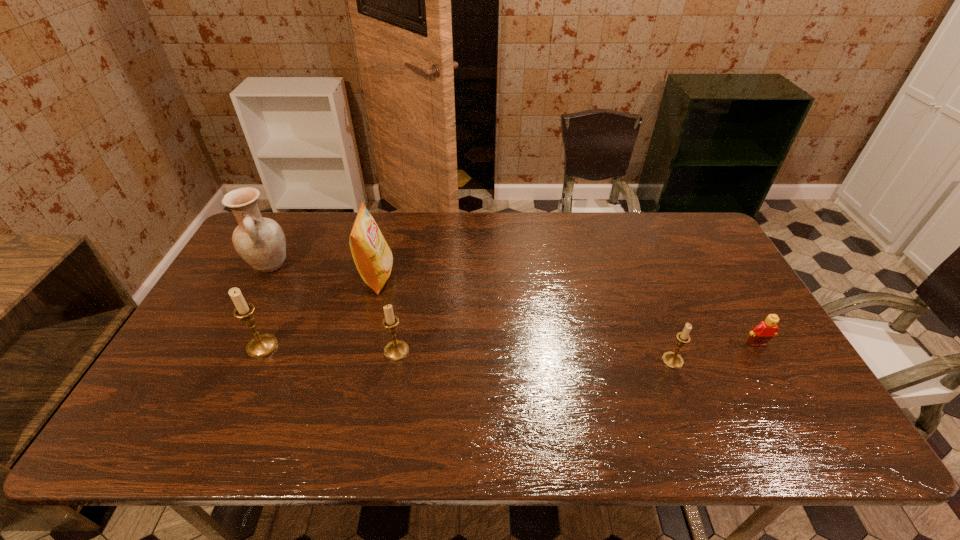
Identify the location of the tallest candle holder. coord(260,346).

The image size is (960, 540). In order to click on the second candle holder from left to right in this screenshot , I will do `click(396, 350)`.

Find the location of a particular element. The image size is (960, 540). the third object from right to left is located at coordinates (396, 350).

Locate an element on the screen. This screenshot has width=960, height=540. the shortest candle holder is located at coordinates (671, 359).

I want to click on the second shortest object, so click(671, 359).

Where is `crisp (potato chip)`? The image size is (960, 540). crisp (potato chip) is located at coordinates pos(373,258).

Where is `pottery`? The width and height of the screenshot is (960, 540). pottery is located at coordinates (260, 241).

You are a GUI agent. You are given a task and a screenshot of the screen. Output one action in this format:
    pyautogui.click(x=<x>, y=<y>)
    Task: Click on the Lego
    The image size is (960, 540).
    Given the screenshot: What is the action you would take?
    pyautogui.click(x=765, y=330)

Locate an element on the screen. This screenshot has width=960, height=540. the rightmost object is located at coordinates (765, 330).

Image resolution: width=960 pixels, height=540 pixels. I want to click on blank space located on the back of the leftmost candle holder, so click(300, 262).